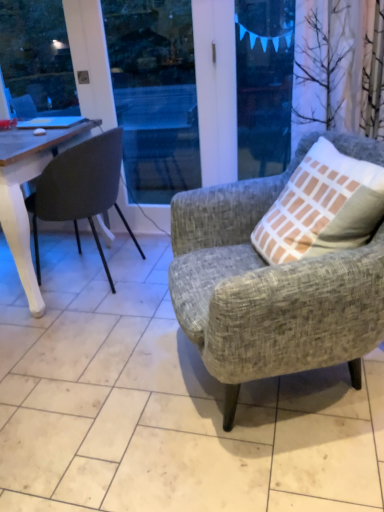
Question: Are transparent plastic window screen at upper center and textured gray armchair at right, marked as the 2th chair in a back-to-front arrangement, making contact?

Choices:
 (A) no
 (B) yes

Answer: (A)

Question: Is textured gray armchair at right, acting as the 1th chair starting from the right, a part of transparent plastic window screen at upper center?

Choices:
 (A) yes
 (B) no

Answer: (B)

Question: Can you confirm if transparent plastic window screen at upper center is bigger than textured gray armchair at right, marked as the 2th chair in a back-to-front arrangement?

Choices:
 (A) yes
 (B) no

Answer: (B)

Question: Is there a large distance between transparent plastic window screen at upper center and textured gray armchair at right, marked as the 2th chair in a back-to-front arrangement?

Choices:
 (A) yes
 (B) no

Answer: (A)

Question: From the image's perspective, is transparent plastic window screen at upper center above textured gray armchair at right, which appears as the first chair when viewed from the front?

Choices:
 (A) no
 (B) yes

Answer: (B)

Question: From a real-world perspective, is textured gray armchair at right, the second chair viewed from the left, physically located above or below transparent plastic window screen at upper center?

Choices:
 (A) above
 (B) below

Answer: (B)

Question: Is textured gray armchair at right, the second chair viewed from the left, bigger or smaller than transparent plastic window screen at upper center?

Choices:
 (A) small
 (B) big

Answer: (B)

Question: From their relative heights in the image, would you say textured gray armchair at right, acting as the 1th chair starting from the right, is taller or shorter than transparent plastic window screen at upper center?

Choices:
 (A) tall
 (B) short

Answer: (B)

Question: Does point (347, 267) appear closer or farther from the camera than point (248, 57)?

Choices:
 (A) farther
 (B) closer

Answer: (B)

Question: Considering the positions of matte black chair at left, the 1th chair when ordered from back to front, and textured gray armchair at right, marked as the 2th chair in a back-to-front arrangement, in the image, is matte black chair at left, the 1th chair when ordered from back to front, wider or thinner than textured gray armchair at right, marked as the 2th chair in a back-to-front arrangement,?

Choices:
 (A) thin
 (B) wide

Answer: (A)

Question: From a real-world perspective, is matte black chair at left, arranged as the second chair when viewed from the front, above or below textured gray armchair at right, the second chair viewed from the left?

Choices:
 (A) below
 (B) above

Answer: (B)

Question: Is matte black chair at left, arranged as the second chair when viewed from the front, to the left or to the right of textured gray armchair at right, acting as the 1th chair starting from the right, in the image?

Choices:
 (A) right
 (B) left

Answer: (B)

Question: From the image's perspective, is matte black chair at left, which ranks as the 1th chair in left-to-right order, positioned above or below textured gray armchair at right, marked as the 2th chair in a back-to-front arrangement?

Choices:
 (A) below
 (B) above

Answer: (B)

Question: From a real-world perspective, is textured gray armchair at right, which appears as the first chair when viewed from the front, physically located above or below matte black chair at left, which ranks as the 1th chair in left-to-right order?

Choices:
 (A) below
 (B) above

Answer: (A)

Question: From the image's perspective, is textured gray armchair at right, the second chair viewed from the left, positioned above or below matte black chair at left, the 1th chair when ordered from back to front?

Choices:
 (A) above
 (B) below

Answer: (B)